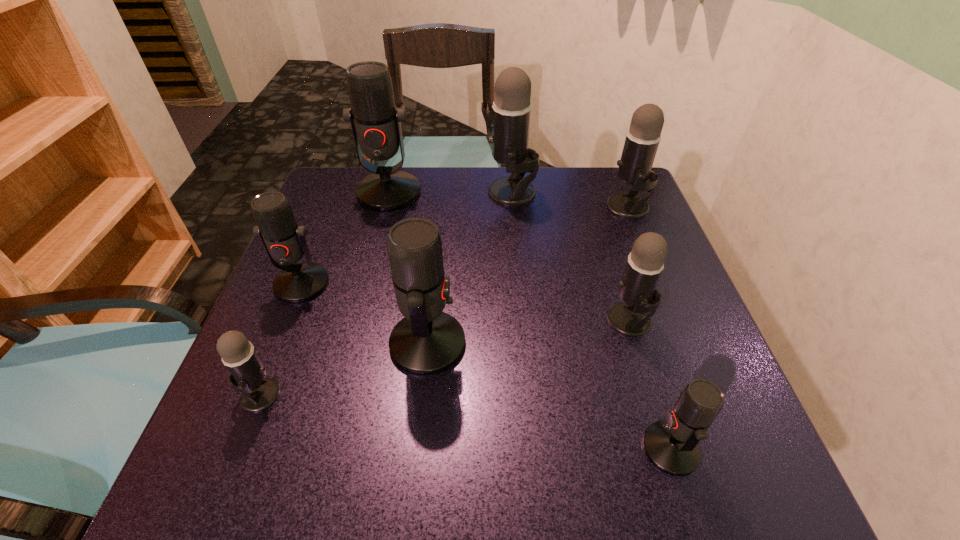
I want to click on the nearest red microphone, so click(672, 446).

This screenshot has width=960, height=540. I want to click on free space located 0.330m on the front of the fifth object from left to right, so click(522, 305).

Find the location of a particular element. free point located 0.070m on the side of the biggest red microphone with the red ring is located at coordinates (379, 229).

The height and width of the screenshot is (540, 960). I want to click on free spot located on the side of the second nearest red microphone with the red ring, so click(x=678, y=343).

Locate an element on the screen. free space located 0.060m on the front of the third smallest gray microphone is located at coordinates (639, 237).

The width and height of the screenshot is (960, 540). I want to click on vacant space located on the left of the second nearest gray microphone, so click(x=441, y=321).

You are a GUI agent. You are given a task and a screenshot of the screen. Output one action in this format:
    pyautogui.click(x=<x>, y=<y>)
    Task: Click on the free region located on the side of the third biggest red microphone with the red ring
    Image resolution: width=960 pixels, height=540 pixels.
    Given the screenshot: What is the action you would take?
    (x=242, y=435)

The width and height of the screenshot is (960, 540). Identify the location of free location located on the right of the leftmost gray microphone. (484, 394).

Where is `free space located on the side of the rightmost red microphone with the red ring`? Image resolution: width=960 pixels, height=540 pixels. free space located on the side of the rightmost red microphone with the red ring is located at coordinates (540, 448).

The image size is (960, 540). Find the location of `vacant area situated on the side of the rightmost red microphone with the red ring`. vacant area situated on the side of the rightmost red microphone with the red ring is located at coordinates (605, 448).